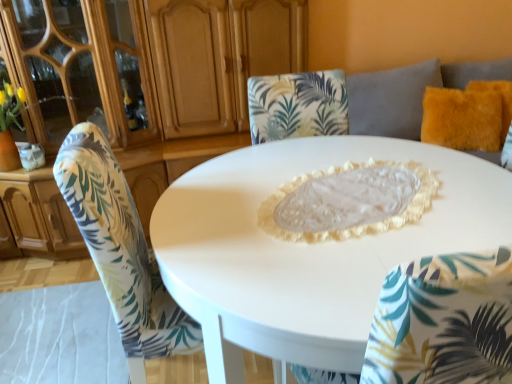
What do you see at coordinates (121, 250) in the screenshot? The height and width of the screenshot is (384, 512). I see `printed fabric chair at center` at bounding box center [121, 250].

What is the approximate height of matte wood dresser at upper left?

matte wood dresser at upper left is 1.34 meters tall.

Describe the element at coordinates (307, 249) in the screenshot. The image size is (512, 384). I see `white glossy table at center` at that location.

Find the location of a particular element. The image size is (512, 384). fuzzy orange pillow at upper right is located at coordinates (462, 119).

In terms of size, does matte wood dresser at upper left appear bigger or smaller than white glossy table at center?

matte wood dresser at upper left is bigger than white glossy table at center.

Is matte wood dresser at upper left facing away from white glossy table at center?

matte wood dresser at upper left is not turned away from white glossy table at center.

Considering the relative sizes of matte wood dresser at upper left and white glossy table at center in the image provided, is matte wood dresser at upper left shorter than white glossy table at center?

Incorrect, the height of matte wood dresser at upper left does not fall short of that of white glossy table at center.

Is matte wood dresser at upper left closer to the viewer compared to white glossy table at center?

No, it is behind white glossy table at center.

From a real-world perspective, who is located higher, printed fabric chair at center or white glossy table at center?

printed fabric chair at center.

Who is shorter, printed fabric chair at center or white glossy table at center?

white glossy table at center is shorter.

Does printed fabric chair at center touch white glossy table at center?

They are not placed beside each other.

I want to click on table below the printed fabric chair at center (from a real-world perspective), so click(x=307, y=249).

Can you confirm if printed fabric chair at center is bigger than matte wood dresser at upper left?

Incorrect, printed fabric chair at center is not larger than matte wood dresser at upper left.

Which point is more forward, (170, 325) or (87, 60)?

The point (170, 325) is closer to the camera.

Can you confirm if printed fabric chair at center is taller than matte wood dresser at upper left?

No, printed fabric chair at center is not taller than matte wood dresser at upper left.

Is fuzzy orange pillow at upper right inside the boundaries of matte wood dresser at upper left, or outside?

fuzzy orange pillow at upper right is spatially situated outside matte wood dresser at upper left.

Image resolution: width=512 pixels, height=384 pixels. In order to click on dresser lying in front of the fuzzy orange pillow at upper right in this screenshot , I will do (x=148, y=74).

Is the depth of fuzzy orange pillow at upper right greater than that of matte wood dresser at upper left?

Yes, it is behind matte wood dresser at upper left.

From a real-world perspective, is fuzzy orange pillow at upper right located beneath matte wood dresser at upper left?

Correct, in the physical world, fuzzy orange pillow at upper right is lower than matte wood dresser at upper left.

Looking at this image, considering the sizes of objects printed fabric chair at center and fuzzy orange pillow at upper right in the image provided, who is wider, printed fabric chair at center or fuzzy orange pillow at upper right?

With larger width is printed fabric chair at center.

Looking at this image, how many degrees apart are the facing directions of printed fabric chair at center and fuzzy orange pillow at upper right?

The angular difference between printed fabric chair at center and fuzzy orange pillow at upper right is 94.9 degrees.

Does point (185, 321) come closer to viewer compared to point (437, 119)?

Yes, point (185, 321) is closer to viewer.

Is white glossy table at center in front of or behind fuzzy orange pillow at upper right in the image?

white glossy table at center is in front of fuzzy orange pillow at upper right.

Is white glossy table at center turned away from fuzzy orange pillow at upper right?

Result: No.

Does white glossy table at center have a lesser width compared to fuzzy orange pillow at upper right?

Incorrect, the width of white glossy table at center is not less than that of fuzzy orange pillow at upper right.

Is fuzzy orange pillow at upper right taller than white glossy table at center?

Incorrect, the height of fuzzy orange pillow at upper right is not larger of that of white glossy table at center.

This screenshot has height=384, width=512. In order to click on pillow behind the white glossy table at center in this screenshot , I will do `click(462, 119)`.

Would you say fuzzy orange pillow at upper right is inside or outside white glossy table at center?

fuzzy orange pillow at upper right is not enclosed by white glossy table at center.

Is fuzzy orange pillow at upper right looking in the opposite direction of white glossy table at center?

No, white glossy table at center is not at the back of fuzzy orange pillow at upper right.

The height and width of the screenshot is (384, 512). What are the coordinates of `dresser lying on the left of white glossy table at center` in the screenshot? It's located at (148, 74).

I want to click on table in front of the printed fabric chair at center, so click(307, 249).

In the scene shown: Considering their positions, is fuzzy orange pillow at upper right positioned closer to white glossy table at center than matte wood dresser at upper left?

Result: matte wood dresser at upper left is closer to white glossy table at center.

Estimate the real-world distances between objects in this image. Which object is further from printed fabric chair at center, white glossy table at center or matte wood dresser at upper left?

matte wood dresser at upper left is positioned further to the anchor printed fabric chair at center.

Which object lies further to the anchor point matte wood dresser at upper left, white glossy table at center or printed fabric chair at center?

Based on the image, printed fabric chair at center appears to be further to matte wood dresser at upper left.

From the image, which object appears to be nearer to fuzzy orange pillow at upper right, white glossy table at center or printed fabric chair at center?

The object closer to fuzzy orange pillow at upper right is white glossy table at center.

Based on their spatial positions, is printed fabric chair at center or white glossy table at center further from matte wood dresser at upper left?

printed fabric chair at center.

From the image, which object appears to be farther from fuzzy orange pillow at upper right, printed fabric chair at center or matte wood dresser at upper left?

printed fabric chair at center is positioned further to the anchor fuzzy orange pillow at upper right.

Estimate the real-world distances between objects in this image. Which object is closer to white glossy table at center, printed fabric chair at center or matte wood dresser at upper left?

printed fabric chair at center lies closer to white glossy table at center than the other object.

Which object lies nearer to the anchor point white glossy table at center, matte wood dresser at upper left or fuzzy orange pillow at upper right?

matte wood dresser at upper left is positioned closer to the anchor white glossy table at center.

The image size is (512, 384). In order to click on chair between white glossy table at center and fuzzy orange pillow at upper right along the z-axis in this screenshot , I will do `click(121, 250)`.

Locate an element on the screen. The width and height of the screenshot is (512, 384). table between matte wood dresser at upper left and fuzzy orange pillow at upper right from left to right is located at coordinates (307, 249).

The height and width of the screenshot is (384, 512). Find the location of `chair situated between matte wood dresser at upper left and fuzzy orange pillow at upper right from left to right`. chair situated between matte wood dresser at upper left and fuzzy orange pillow at upper right from left to right is located at coordinates (121, 250).

I want to click on chair located between white glossy table at center and matte wood dresser at upper left in the depth direction, so click(121, 250).